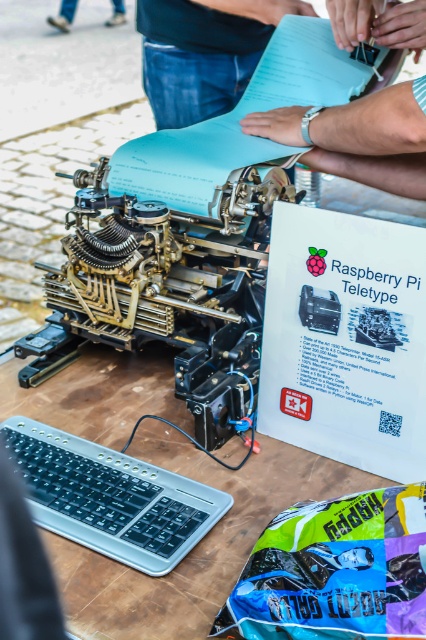
Question: Does wooden table at center lie in front of silver metallic watch at upper center?

Choices:
 (A) no
 (B) yes

Answer: (B)

Question: Is silver metallic watch at upper center positioned at the back of matte black hands at upper center?

Choices:
 (A) yes
 (B) no

Answer: (B)

Question: Does silver metallic keyboard at lower left have a lesser width compared to silver metallic watch at upper center?

Choices:
 (A) no
 (B) yes

Answer: (A)

Question: Estimate the real-world distances between objects in this image. Which object is closer to the silver metallic watch at upper center?

Choices:
 (A) wooden table at center
 (B) brass mechanical typewriter at center
 (C) silver metallic keyboard at lower left

Answer: (B)

Question: Which object is farther from the camera taking this photo?

Choices:
 (A) blue paper at upper center
 (B) brass mechanical typewriter at center
 (C) wooden table at center

Answer: (A)

Question: Which point is farther from the camera taking this photo?

Choices:
 (A) (74, 362)
 (B) (333, 132)

Answer: (A)